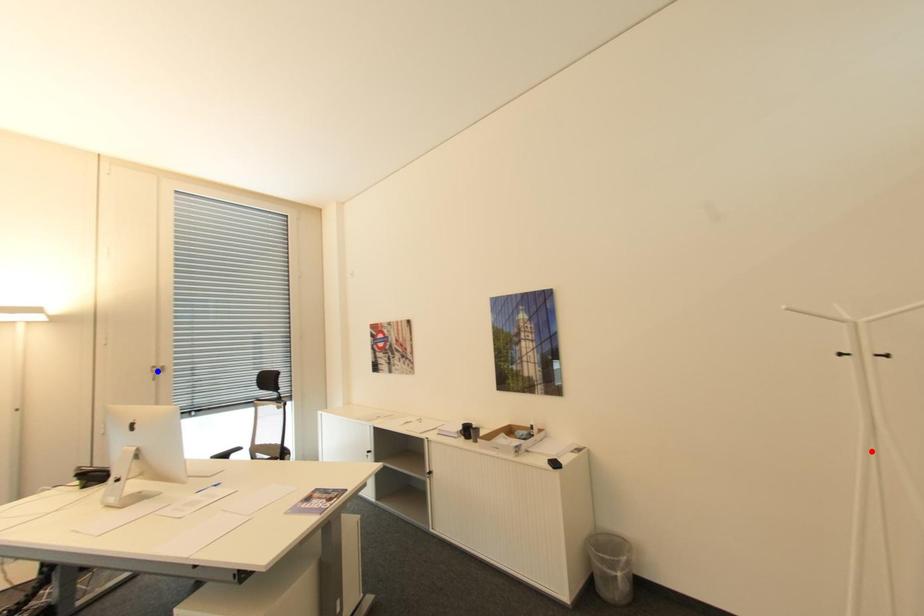
Question: Which of the two points in the image is closer to the camera?

Choices:
 (A) Blue point is closer.
 (B) Red point is closer.

Answer: (B)